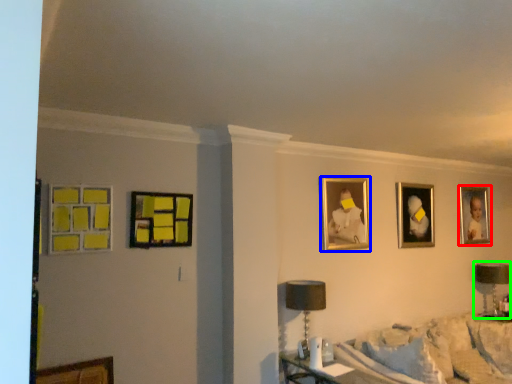
Question: Which is farther away from picture frame (highlighted by a red box)? picture frame (highlighted by a blue box) or table lamp (highlighted by a green box)?

Choices:
 (A) picture frame
 (B) table lamp

Answer: (A)